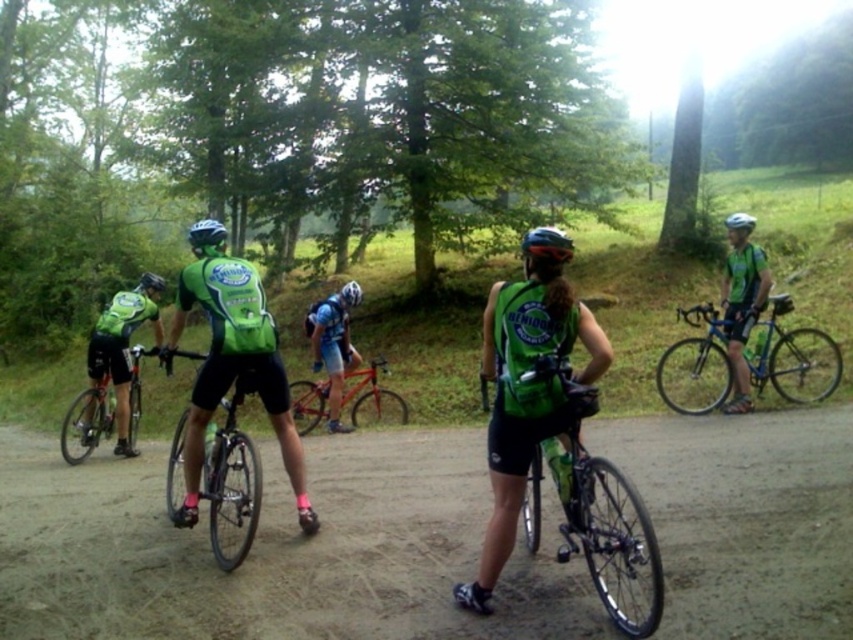
Question: Which point appears farthest from the camera in this image?

Choices:
 (A) (695, 362)
 (B) (728, 221)
 (C) (201, 355)
 (D) (537, 291)

Answer: (A)

Question: Based on their relative distances, which object is farther from the white matte bicycle helmet at center?

Choices:
 (A) shiny orange frame at center
 (B) matte black helmet at upper center
 (C) shiny blue frame at right
 (D) green matte helmet at upper center

Answer: (B)

Question: Which point appears farthest from the camera in this image?

Choices:
 (A) (553, 262)
 (B) (317, 401)
 (C) (749, 214)

Answer: (C)

Question: Does shiny black bicycle at center come in front of matte green helmet at center?

Choices:
 (A) no
 (B) yes

Answer: (B)

Question: Where is shiny silver bicycle at left located in relation to matte black helmet at center in the image?

Choices:
 (A) below
 (B) above

Answer: (A)

Question: Is matte black helmet at center positioned at the back of matte black helmet at upper center?

Choices:
 (A) no
 (B) yes

Answer: (A)